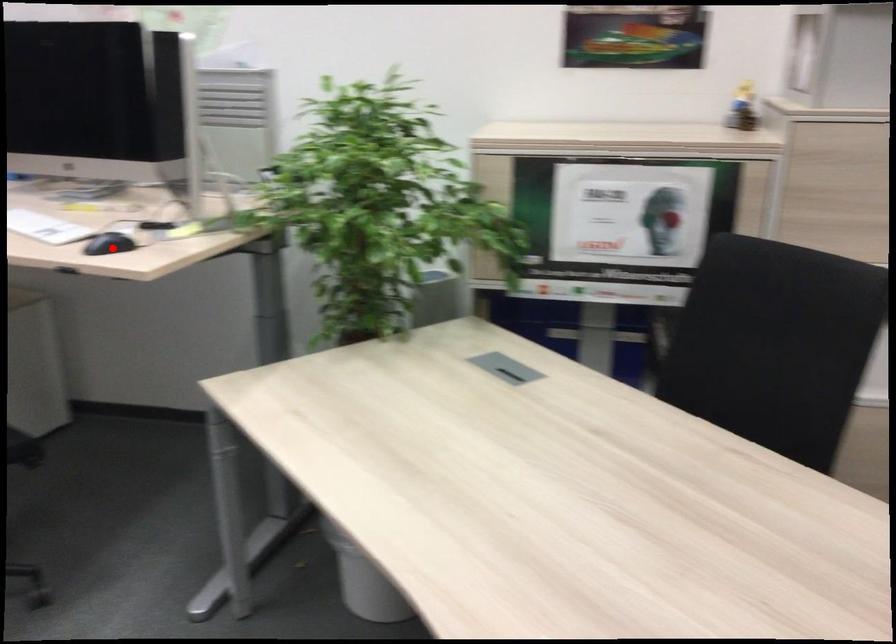
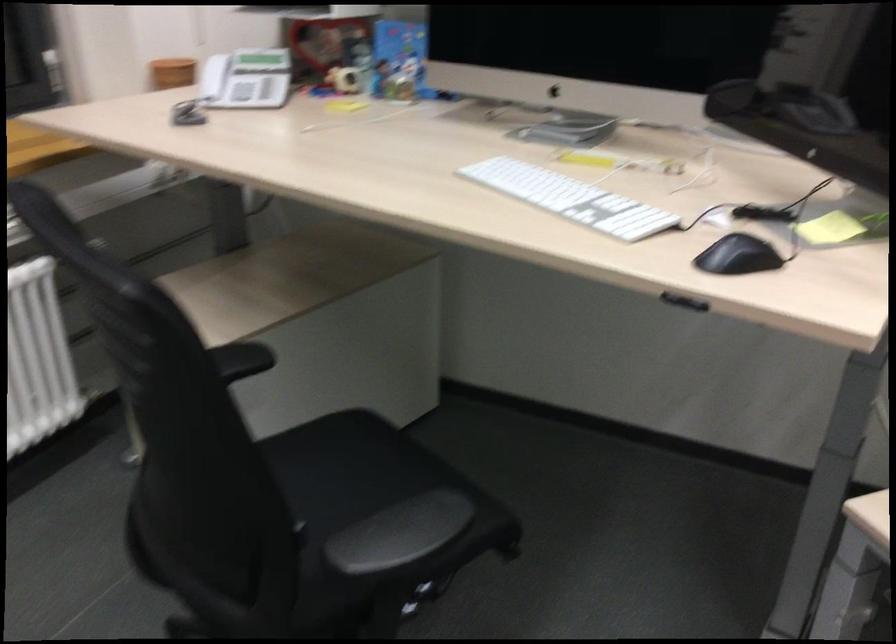
In the second image, find the point that corresponds to the highlighted location in the first image.

(737, 256)